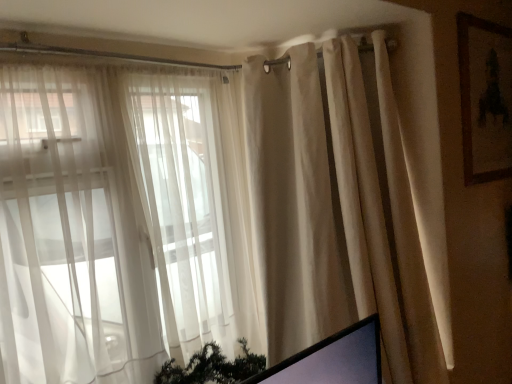
Question: From the image's perspective, is brown wooden picture frame at upper right below sheer white curtains at left?

Choices:
 (A) yes
 (B) no

Answer: (B)

Question: Is the position of brown wooden picture frame at upper right less distant than that of sheer white curtains at left?

Choices:
 (A) yes
 (B) no

Answer: (B)

Question: Is brown wooden picture frame at upper right not within sheer white curtains at left?

Choices:
 (A) yes
 (B) no

Answer: (A)

Question: Can you confirm if brown wooden picture frame at upper right is positioned to the left of sheer white curtains at left?

Choices:
 (A) no
 (B) yes

Answer: (A)

Question: Considering the relative positions of brown wooden picture frame at upper right and sheer white curtains at left in the image provided, is brown wooden picture frame at upper right behind sheer white curtains at left?

Choices:
 (A) yes
 (B) no

Answer: (A)

Question: Relative to beige fabric curtain at right, is brown wooden picture frame at upper right in front or behind?

Choices:
 (A) front
 (B) behind

Answer: (B)

Question: Looking at their shapes, would you say brown wooden picture frame at upper right is wider or thinner than beige fabric curtain at right?

Choices:
 (A) thin
 (B) wide

Answer: (A)

Question: Considering the positions of brown wooden picture frame at upper right and beige fabric curtain at right in the image, is brown wooden picture frame at upper right bigger or smaller than beige fabric curtain at right?

Choices:
 (A) small
 (B) big

Answer: (A)

Question: Would you say brown wooden picture frame at upper right is to the left or to the right of beige fabric curtain at right in the picture?

Choices:
 (A) left
 (B) right

Answer: (B)

Question: From their relative heights in the image, would you say sheer white curtains at left is taller or shorter than brown wooden picture frame at upper right?

Choices:
 (A) short
 (B) tall

Answer: (B)

Question: Looking at the image, does sheer white curtains at left seem bigger or smaller compared to brown wooden picture frame at upper right?

Choices:
 (A) small
 (B) big

Answer: (B)

Question: From the image's perspective, is sheer white curtains at left located above or below brown wooden picture frame at upper right?

Choices:
 (A) below
 (B) above

Answer: (A)

Question: Is sheer white curtains at left wider or thinner than brown wooden picture frame at upper right?

Choices:
 (A) wide
 (B) thin

Answer: (A)

Question: Is point (474, 89) closer or farther from the camera than point (201, 284)?

Choices:
 (A) closer
 (B) farther

Answer: (B)

Question: In terms of size, does brown wooden picture frame at upper right appear bigger or smaller than sheer white curtains at left?

Choices:
 (A) big
 (B) small

Answer: (B)